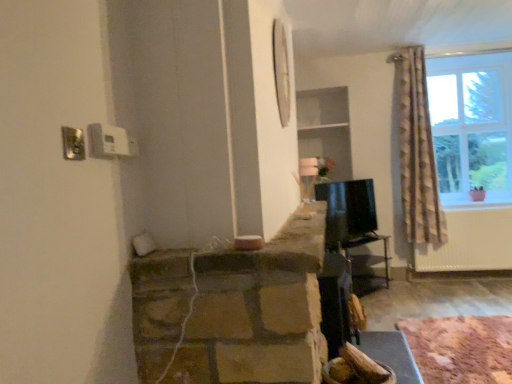
Question: Would you say rustic wooden logs at lower right is to the left or to the right of metallic dark brown table at center in the picture?

Choices:
 (A) right
 (B) left

Answer: (A)

Question: Is rustic wooden logs at lower right in front of or behind metallic dark brown table at center in the image?

Choices:
 (A) front
 (B) behind

Answer: (A)

Question: In terms of height, does rustic wooden logs at lower right look taller or shorter compared to metallic dark brown table at center?

Choices:
 (A) short
 (B) tall

Answer: (A)

Question: In terms of height, does metallic dark brown table at center look taller or shorter compared to rustic wooden logs at lower right?

Choices:
 (A) short
 (B) tall

Answer: (B)

Question: In the image, is metallic dark brown table at center on the left side or the right side of rustic wooden logs at lower right?

Choices:
 (A) left
 (B) right

Answer: (A)

Question: From a real-world perspective, is metallic dark brown table at center above or below rustic wooden logs at lower right?

Choices:
 (A) below
 (B) above

Answer: (B)

Question: Is point (386, 240) closer or farther from the camera than point (495, 382)?

Choices:
 (A) farther
 (B) closer

Answer: (A)